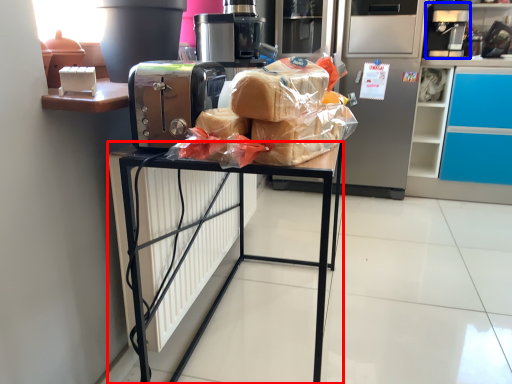
Question: Which point is closer to the camera, furniture (highlighted by a red box) or coffee machine (highlighted by a blue box)?

Choices:
 (A) furniture
 (B) coffee machine

Answer: (A)